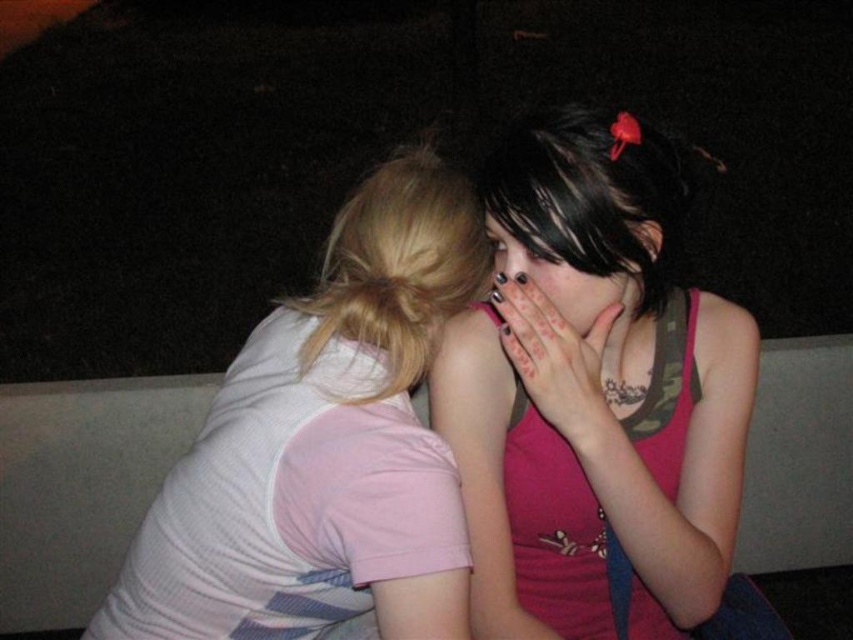
You are an artist trying to sketch this scene. You want to place the pink fabric tank top at center correctly on your canvas. What are the coordinates where you should position it?

The pink fabric tank top at center should be positioned at coordinates 0.617 on the x axis and 0.696 on the y axis.

You are a photographer trying to capture a closeup shot of the white striped shirt at left and the dark matte hand at center. Which object should you zoom in on to ensure both are in frame without moving the camera?

The white striped shirt at left is wider than the dark matte hand at center, so you should zoom in on the dark matte hand at center to ensure both are in frame without moving the camera.

In the scene shown: You are a photographer trying to capture a candid shot of the two people in the scene. You want to ensure that both the white striped shirt at left and the matte black hair at center are clearly visible in the frame. Given their relative sizes, which object should you focus on first to ensure proper framing?

The white striped shirt at left is wider than the matte black hair at center, so you should focus on the white striped shirt at left first to ensure it fits well within the frame.